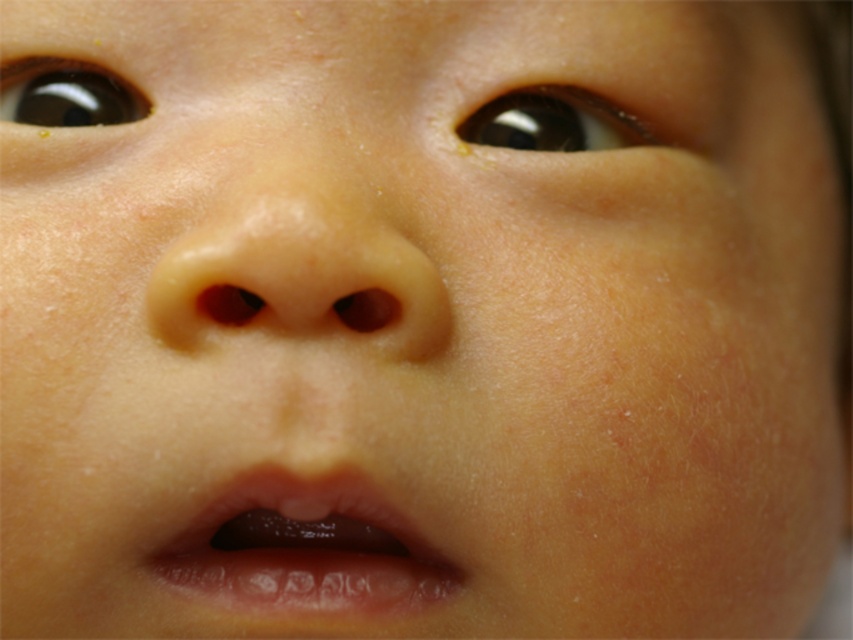
In the scene shown: You are a photographer setting up for a baby photoshoot. The baby has translucent plastic teeth at lower center in their mouth. You need to ensure the teeth are in focus. If your camera has a depth of field of 30 centimeters, will the teeth be in focus?

The translucent plastic teeth at lower center are 32.70 centimeters away from the camera. Since the depth of field is 30 centimeters, the teeth are slightly out of the depth of field range, so they may not be in focus. Adjust the camera settings or move closer to ensure clarity.

You are a pediatric dentist examining a baby. You notice the translucent plastic teeth at lower center. Where exactly is this object positioned relative to the baby?

The translucent plastic teeth at lower center is located at point coordinates of 0.859 on the x axis and 0.360 on the y axis.

You are a pediatric dentist examining a baby. You notice the translucent plastic teeth at lower center and the brown glossy eye at upper center. Which object is positioned more to the left side of the baby?

The translucent plastic teeth at lower center is positioned more to the left side of the baby than the brown glossy eye at upper center.